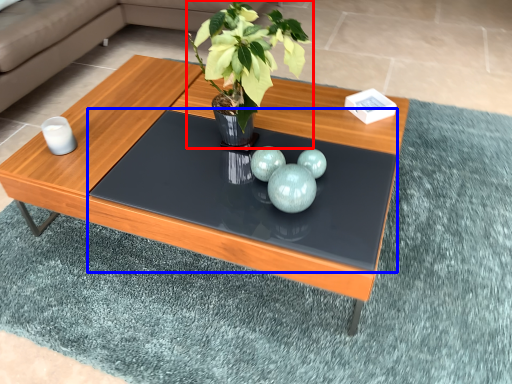
Question: Which object is closer to the camera taking this photo, houseplant (highlighted by a red box) or glass table (highlighted by a blue box)?

Choices:
 (A) houseplant
 (B) glass table

Answer: (A)